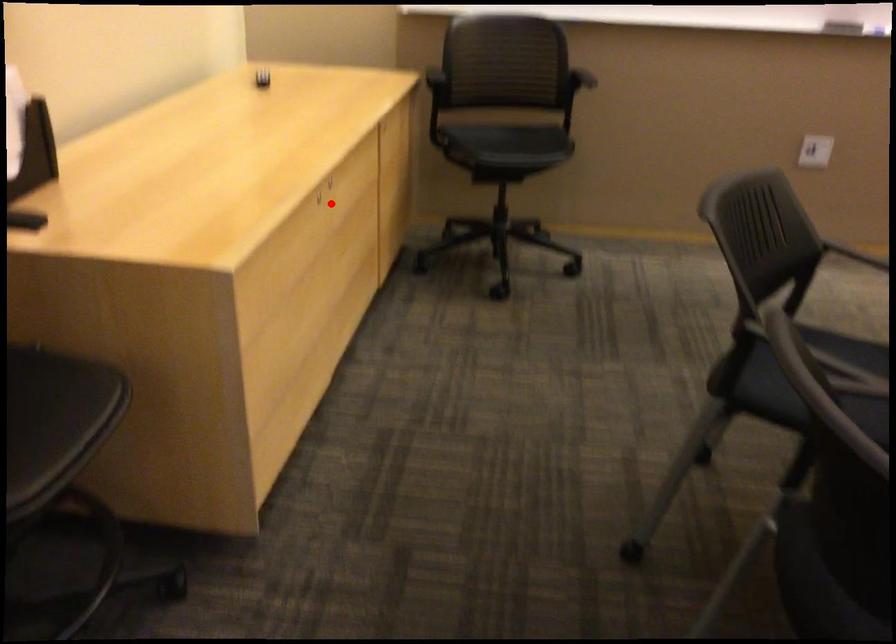
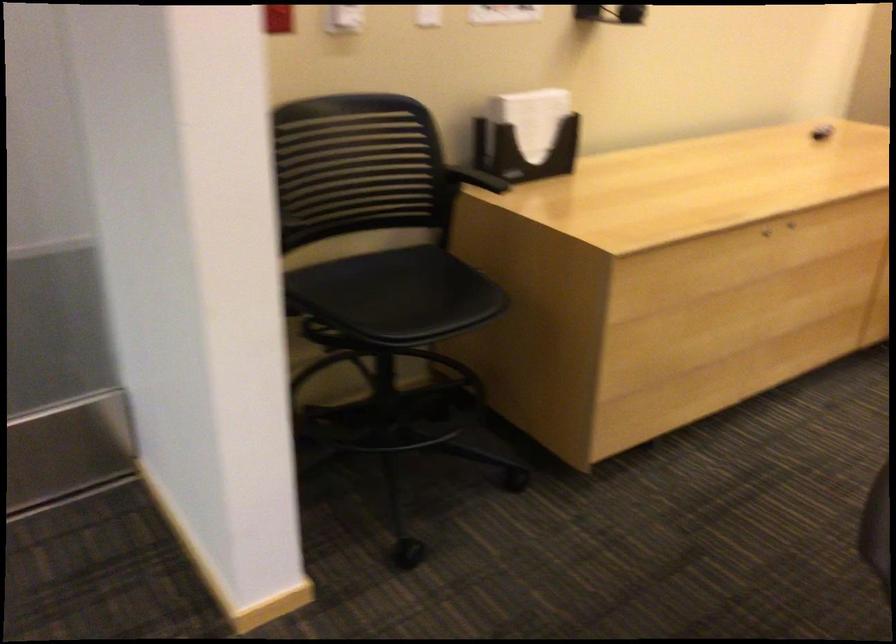
In the second image, find the point that corresponds to the highlighted location in the first image.

(765, 232)